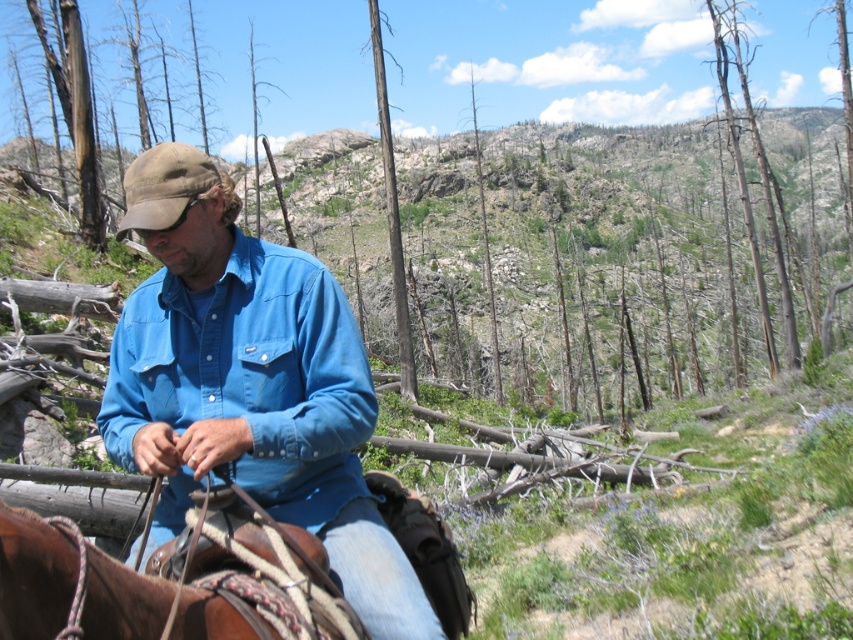
You are a photographer planning to capture a closeup shot of the brown leather saddle at lower left and the dead wood at center. Which object should you zoom in on to ensure both fit in the frame without moving the camera?

The brown leather saddle at lower left has a lesser width compared to dead wood at center, so you should zoom in on the dead wood at center to ensure both fit in the frame without moving the camera.

You are a hiker who wants to place a marker exactly halfway between the man and the horse. The coordinates of the man are at point (x=146, y=582). What are the coordinates of the midpoint?

The midpoint between the man and the horse would be at coordinates calculated by averaging their respective coordinates. Since the distance between them is 5.34 feet, the midpoint would be 2.67 feet from each point. However, without the horse coordinates, we cannot provide exact coordinates. Please provide the horse coordinates for accurate calculation.

Based on the photo, you are a photographer trying to capture the brown leather saddle at lower left. You notice a point marked at coordinates [157,589]. Is this point likely located on the saddle?

Yes, the point [157,589] corresponds to the brown leather saddle at lower left, so it is likely located on the saddle.